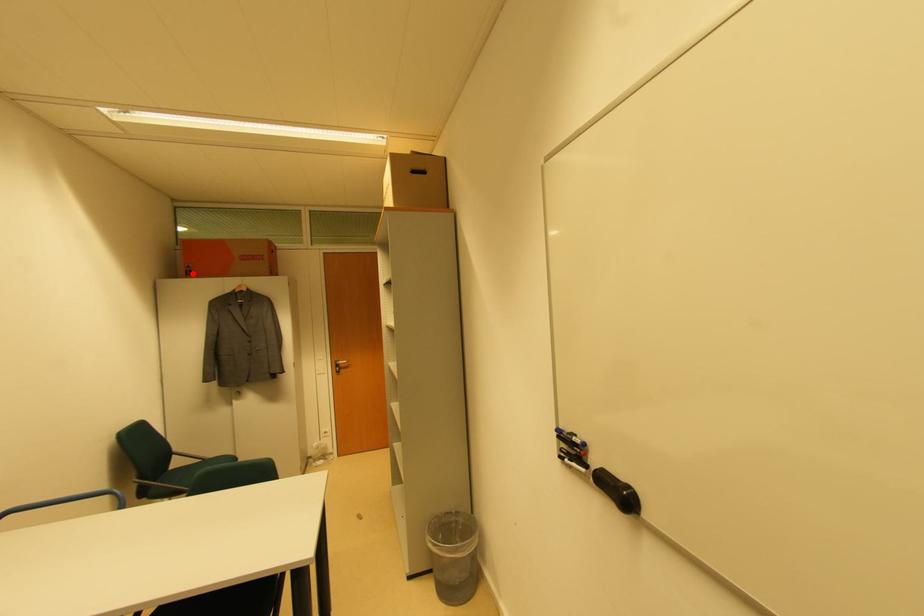
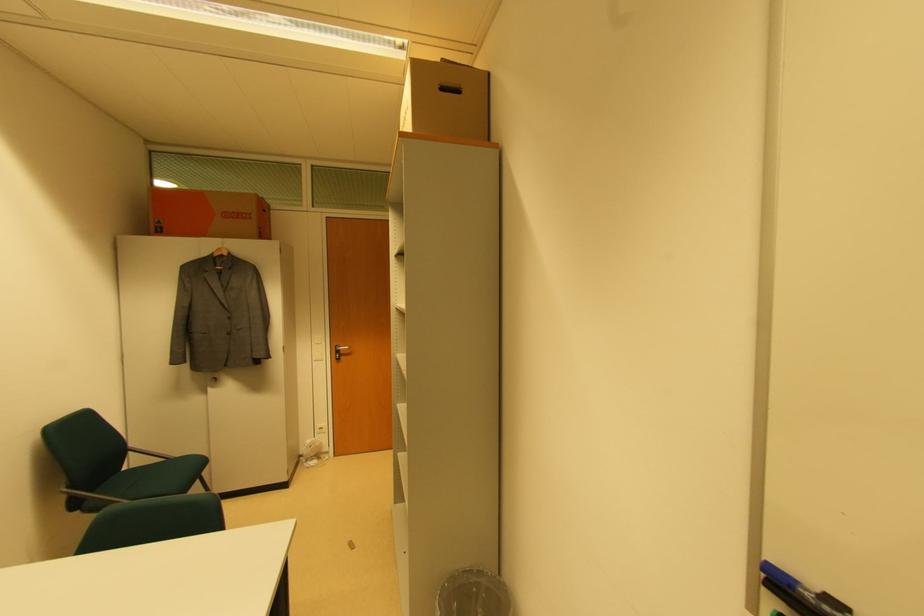
Locate, in the second image, the point that corresponds to the highlighted location in the first image.

(163, 230)